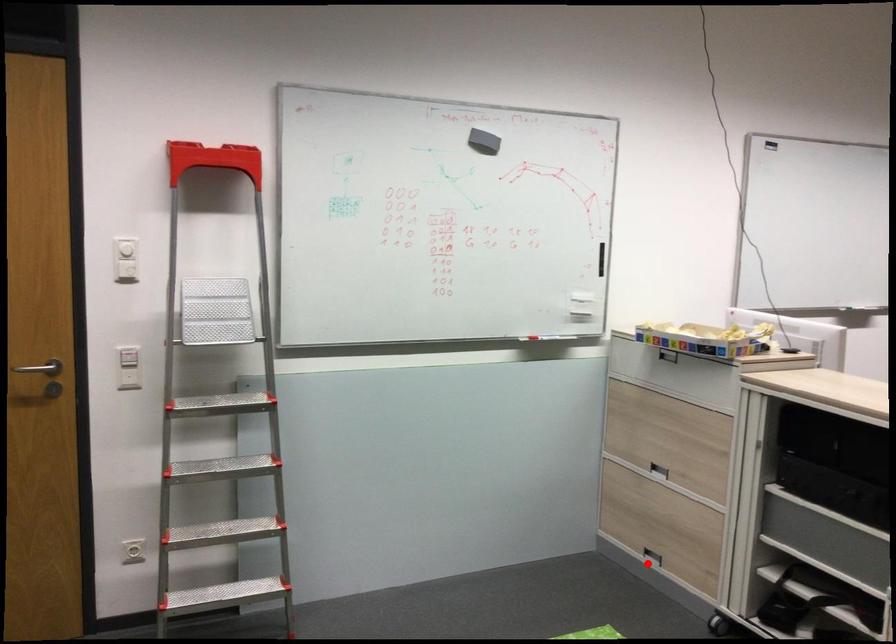
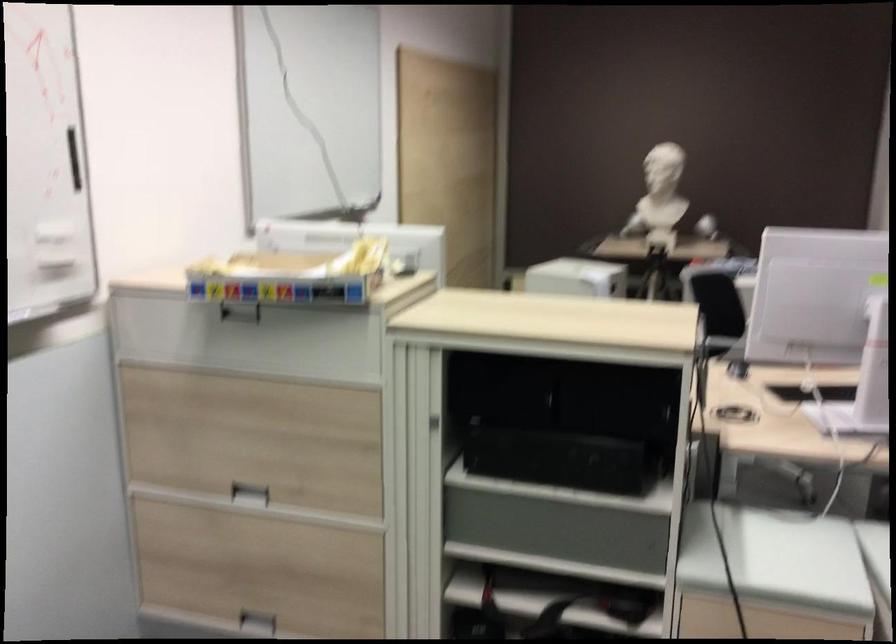
Where in the second image is the point corresponding to the highlighted location from the first image?

(257, 623)